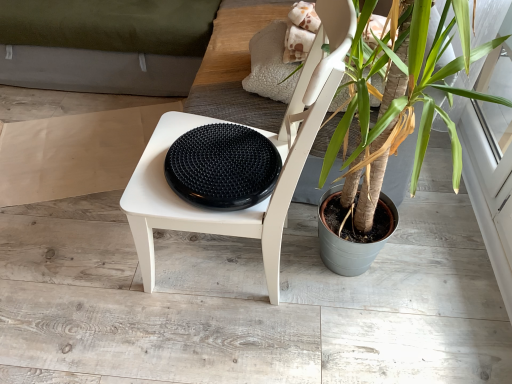
Question: Is green leafy plant at center positioned with its back to beige paper at left?

Choices:
 (A) yes
 (B) no

Answer: (B)

Question: Considering the relative sizes of green leafy plant at center and beige paper at left in the image provided, is green leafy plant at center taller than beige paper at left?

Choices:
 (A) yes
 (B) no

Answer: (A)

Question: Is green leafy plant at center in front of beige paper at left?

Choices:
 (A) yes
 (B) no

Answer: (A)

Question: From the image's perspective, would you say green leafy plant at center is positioned over beige paper at left?

Choices:
 (A) yes
 (B) no

Answer: (B)

Question: Are green leafy plant at center and beige paper at left making contact?

Choices:
 (A) no
 (B) yes

Answer: (A)

Question: Is green leafy plant at center to the left of beige paper at left from the viewer's perspective?

Choices:
 (A) yes
 (B) no

Answer: (B)

Question: Is green leafy plant at center smaller than black rubber disc at center?

Choices:
 (A) no
 (B) yes

Answer: (A)

Question: Is green leafy plant at center taller than black rubber disc at center?

Choices:
 (A) no
 (B) yes

Answer: (B)

Question: Is the position of green leafy plant at center more distant than that of black rubber disc at center?

Choices:
 (A) yes
 (B) no

Answer: (B)

Question: Is green leafy plant at center thinner than black rubber disc at center?

Choices:
 (A) no
 (B) yes

Answer: (A)

Question: Is the position of green leafy plant at center less distant than that of black rubber disc at center?

Choices:
 (A) no
 (B) yes

Answer: (B)

Question: From a real-world perspective, is green leafy plant at center located higher than black rubber disc at center?

Choices:
 (A) no
 (B) yes

Answer: (B)

Question: Considering the relative sizes of white matte chair at center and black rubber disc at center in the image provided, is white matte chair at center wider than black rubber disc at center?

Choices:
 (A) yes
 (B) no

Answer: (A)